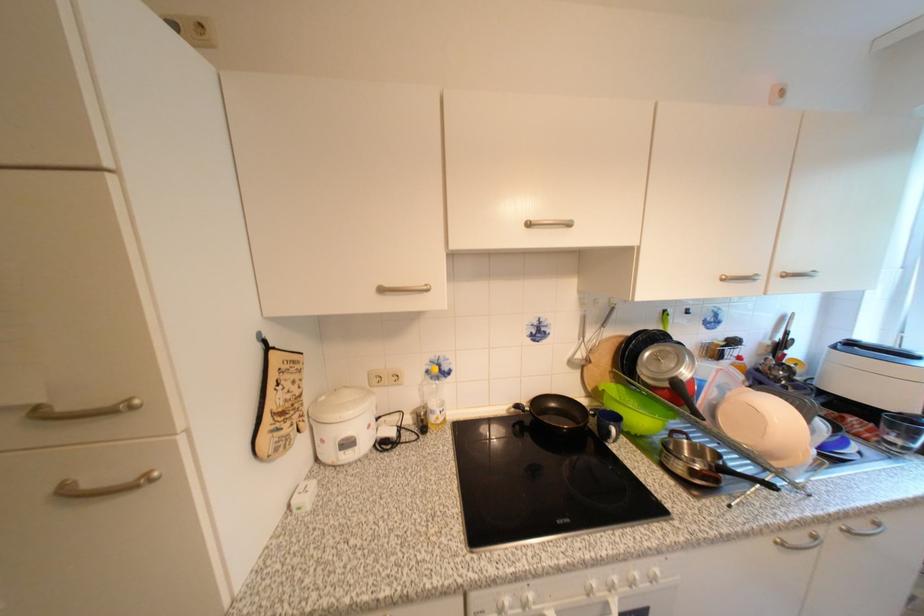
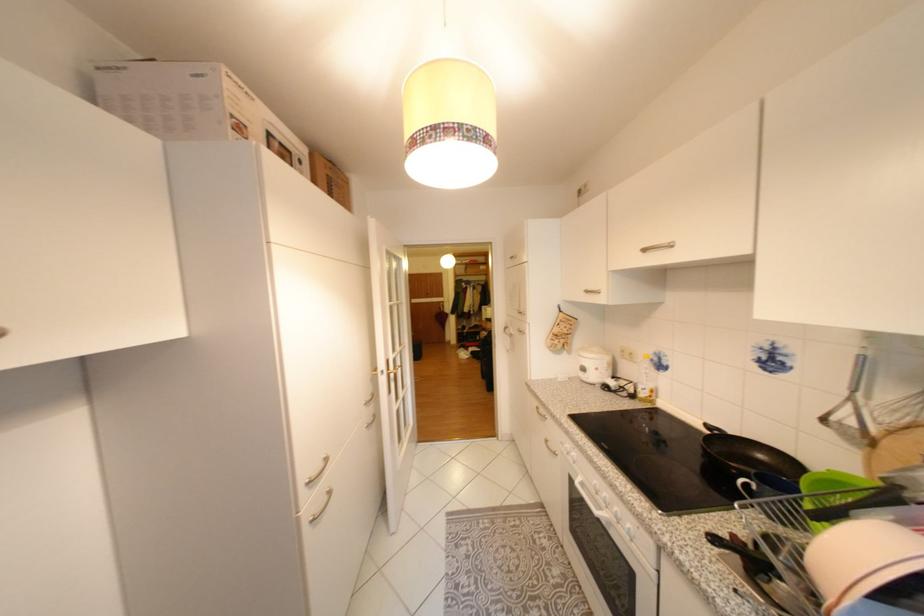
Find the pixel in the second image that matches (x=391, y=291) in the first image.

(596, 292)